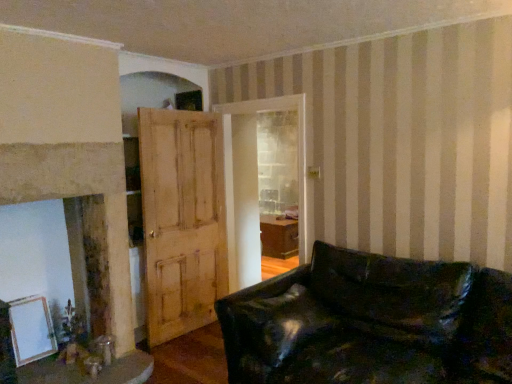
Question: From the image's perspective, is wooden table at lower left on white matte picture frame at lower left?

Choices:
 (A) yes
 (B) no

Answer: (B)

Question: Considering the relative positions of wooden table at lower left and white matte picture frame at lower left in the image provided, is wooden table at lower left to the left of white matte picture frame at lower left from the viewer's perspective?

Choices:
 (A) yes
 (B) no

Answer: (B)

Question: Could white matte picture frame at lower left be considered to be inside wooden table at lower left?

Choices:
 (A) no
 (B) yes

Answer: (A)

Question: From a real-world perspective, is wooden table at lower left beneath white matte picture frame at lower left?

Choices:
 (A) no
 (B) yes

Answer: (B)

Question: Is wooden table at lower left thinner than white matte picture frame at lower left?

Choices:
 (A) no
 (B) yes

Answer: (A)

Question: From the image's perspective, is black leather couch at lower right positioned above or below wooden table at lower left?

Choices:
 (A) above
 (B) below

Answer: (A)

Question: Is black leather couch at lower right taller or shorter than wooden table at lower left?

Choices:
 (A) tall
 (B) short

Answer: (A)

Question: Is black leather couch at lower right inside the boundaries of wooden table at lower left, or outside?

Choices:
 (A) outside
 (B) inside

Answer: (A)

Question: Relative to wooden table at lower left, is black leather couch at lower right in front or behind?

Choices:
 (A) front
 (B) behind

Answer: (A)

Question: Is light brown wooden door at center in front of or behind black leather couch at lower right in the image?

Choices:
 (A) front
 (B) behind

Answer: (B)

Question: Is light brown wooden door at center wider or thinner than black leather couch at lower right?

Choices:
 (A) thin
 (B) wide

Answer: (A)

Question: Does point (220, 134) appear closer or farther from the camera than point (424, 279)?

Choices:
 (A) closer
 (B) farther

Answer: (B)

Question: Which is correct: light brown wooden door at center is inside black leather couch at lower right, or outside of it?

Choices:
 (A) outside
 (B) inside

Answer: (A)

Question: Considering the relative positions of light brown wooden door at center and white matte picture frame at lower left in the image provided, is light brown wooden door at center to the left or to the right of white matte picture frame at lower left?

Choices:
 (A) right
 (B) left

Answer: (A)

Question: From a real-world perspective, relative to white matte picture frame at lower left, is light brown wooden door at center vertically above or below?

Choices:
 (A) above
 (B) below

Answer: (A)